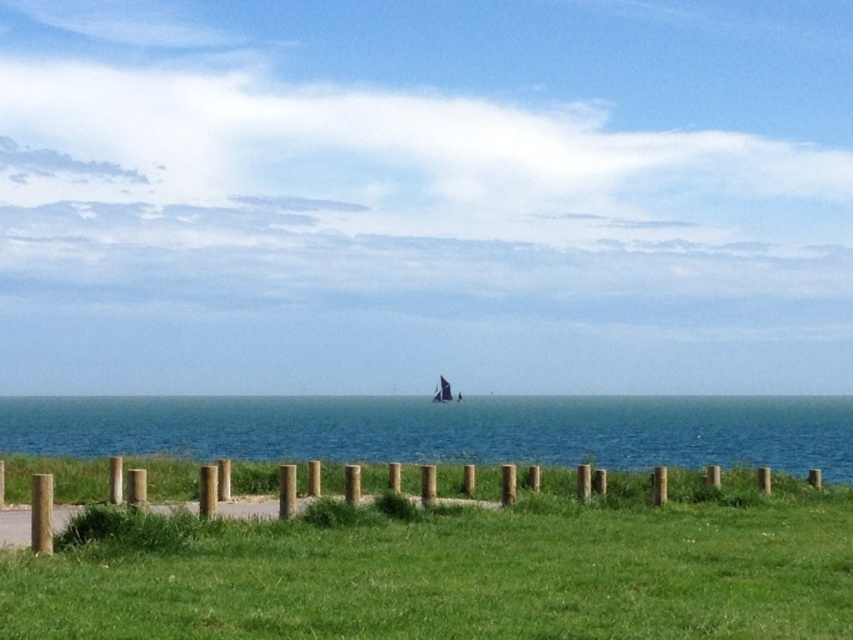
Question: Which object is closer to the camera taking this photo?

Choices:
 (A) wooden posts at center
 (B) green grass at center

Answer: (B)

Question: Estimate the real-world distances between objects in this image. Which object is closer to the blue water at center?

Choices:
 (A) wooden posts at center
 (B) green grass at center

Answer: (A)

Question: Is green grass at center smaller than wooden posts at center?

Choices:
 (A) yes
 (B) no

Answer: (A)

Question: Estimate the real-world distances between objects in this image. Which object is farther from the wooden posts at center?

Choices:
 (A) blue water at center
 (B) green grass at center

Answer: (A)

Question: Can you confirm if green grass at center is thinner than blue water at center?

Choices:
 (A) no
 (B) yes

Answer: (B)

Question: Does blue water at center lie in front of wooden posts at center?

Choices:
 (A) no
 (B) yes

Answer: (A)